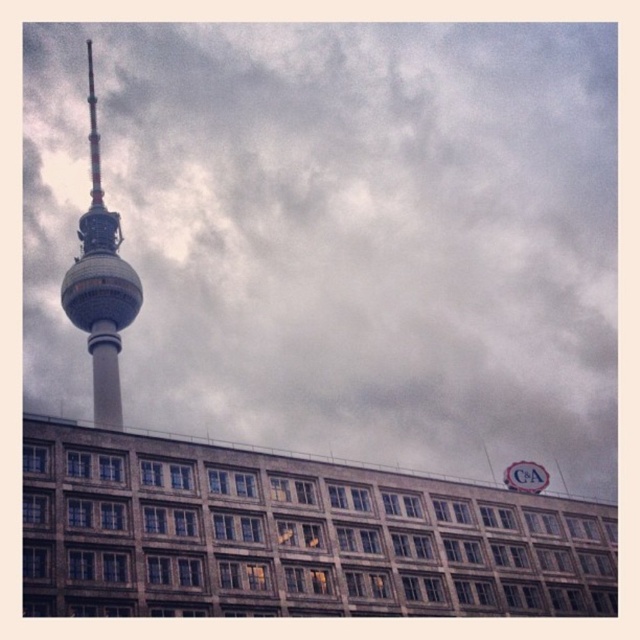
You are a photographer planning to capture the metallic silver tower at left against the cloudy gray sky at upper center. Based on the scene, where should you position yourself to ensure the tower is framed under the sky?

The cloudy gray sky at upper center is located above the metallic silver tower at left, so positioning yourself in front of the tower and looking upward will frame the tower under the sky.

You are a photographer planning to take a photo of the metallic silver tower at left. You want to ensure the cloudy gray sky at upper center is visible in the background. Based on their heights, will the tower be mostly visible against the sky?

The cloudy gray sky at upper center has a greater height compared to the metallic silver tower at left, so the tower will be mostly visible against the sky since the sky extends higher up.